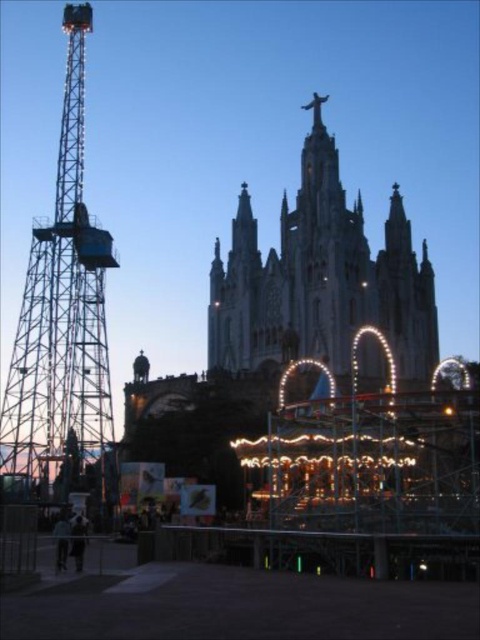
Consider the image. You are standing at the point closer to the amusement park carousel. Which point are you at, point (338, 305) or point (79, 200)?

Point (79, 200) is closer to the amusement park carousel, so you are at point (79, 200).

You are standing in the amusement park area and want to take a photo of both the stone cathedral at center and the metallic structure at left. Based on their positions, which object should you position closer to the left side of your camera frame to include both in the shot?

You should position the metallic structure at left closer to the left side of your camera frame since the stone cathedral at center is to the right of the metallic structure at left, allowing both to be captured within the frame.